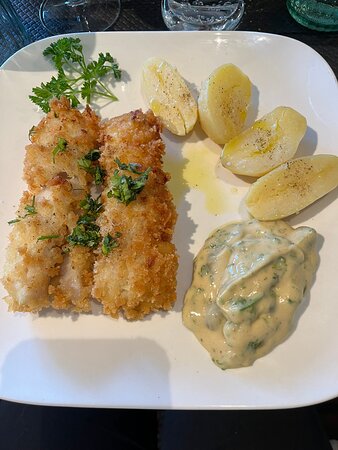
Where is `table`? table is located at coordinates (269, 432).